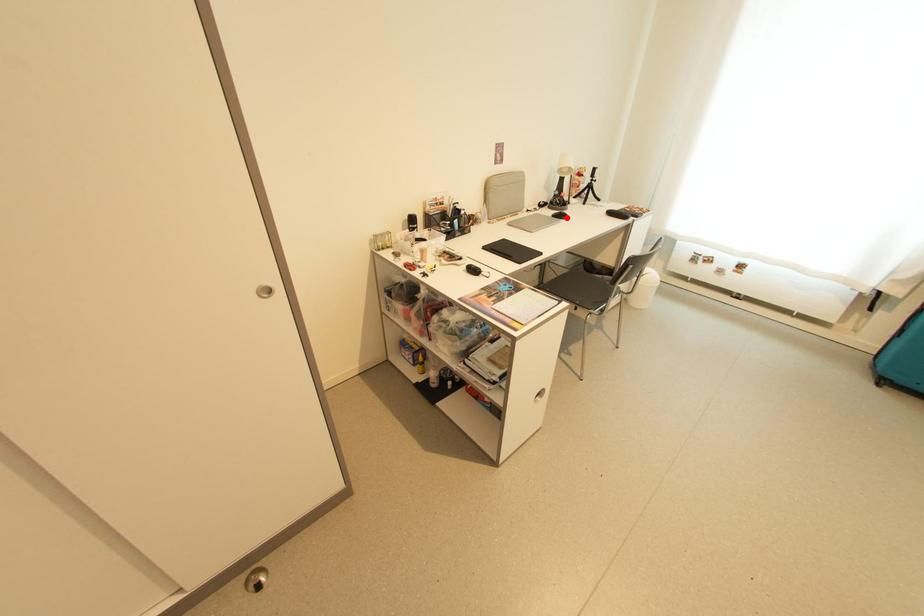
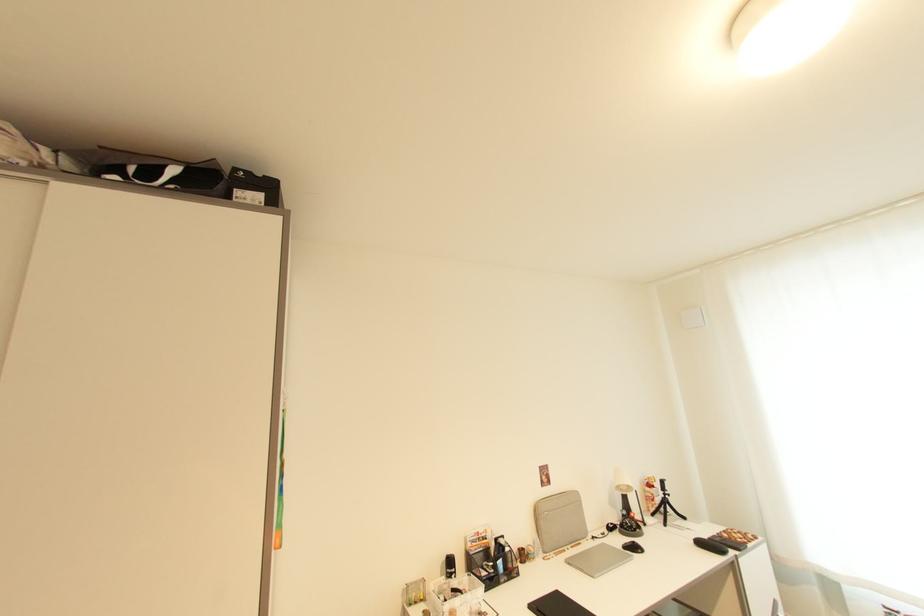
Question: I am providing you with two images of the same scene from different viewpoints. A red point is shown in image1. For the corresponding object point in image2, is it positioned nearer or farther from the camera?

Choices:
 (A) Nearer
 (B) Farther

Answer: (B)